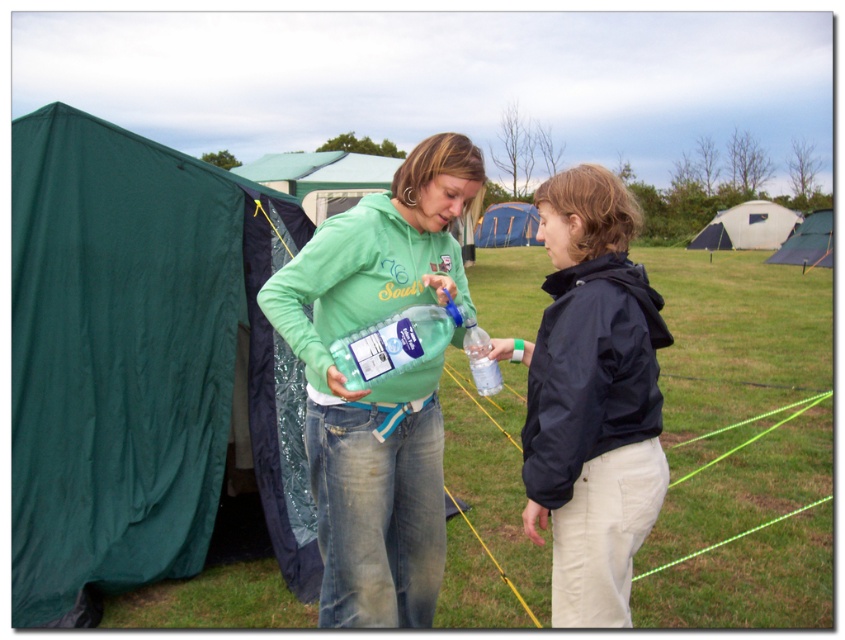
Is green fabric tent at left smaller than navy blue/waterproof jacket at right?

Actually, green fabric tent at left might be larger than navy blue/waterproof jacket at right.

Is the position of green fabric tent at left less distant than that of navy blue/waterproof jacket at right?

No, it is behind navy blue/waterproof jacket at right.

Between point (139, 576) and point (573, 413), which one is positioned behind?

Positioned behind is point (139, 576).

Locate an element on the screen. The width and height of the screenshot is (845, 640). green fabric tent at left is located at coordinates (140, 362).

Is point (584, 312) closer to viewer compared to point (489, 246)?

Yes, it is.

Is dark blue jacket at center further to the viewer compared to blue fabric tent at center?

No, dark blue jacket at center is in front of blue fabric tent at center.

Measure the distance between point [653,337] and camera.

Point [653,337] and camera are 2.19 meters apart.

The width and height of the screenshot is (845, 640). Find the location of `dark blue jacket at center`. dark blue jacket at center is located at coordinates (592, 397).

Which of these two, dark blue jacket at center or green fleece sweatshirt at center, stands taller?

With more height is dark blue jacket at center.

Looking at this image, is dark blue jacket at center thinner than green fleece sweatshirt at center?

Yes, dark blue jacket at center is thinner than green fleece sweatshirt at center.

Is point (608, 547) positioned in front of point (319, 344)?

Yes.

Find the location of a particular element. The width and height of the screenshot is (845, 640). dark blue jacket at center is located at coordinates (592, 397).